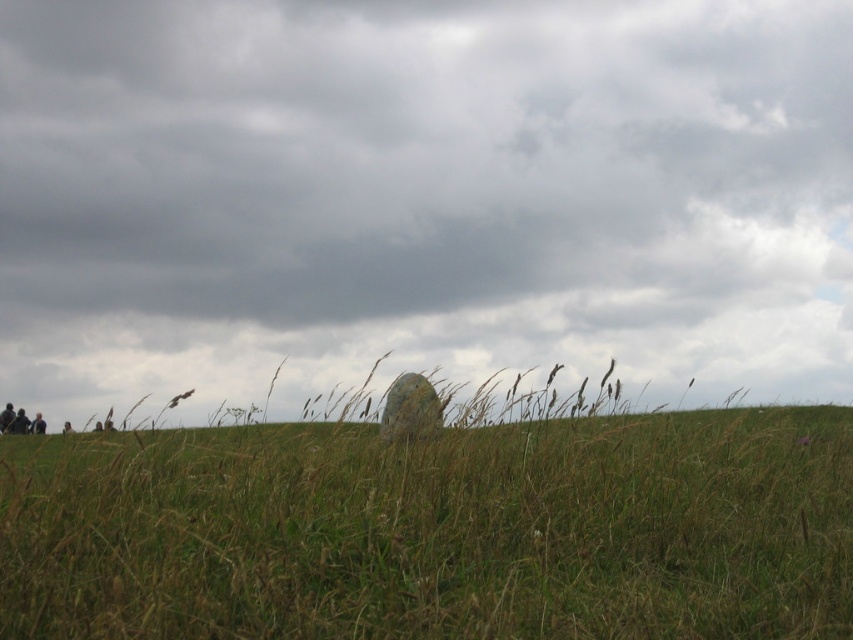
Question: Considering the relative positions of gray cloudy sky at upper center and green grass at center in the image provided, where is gray cloudy sky at upper center located with respect to green grass at center?

Choices:
 (A) below
 (B) above

Answer: (B)

Question: Which object is closer to the camera taking this photo?

Choices:
 (A) gray cloudy sky at upper center
 (B) green grass at center

Answer: (B)

Question: Which object appears closest to the camera in this image?

Choices:
 (A) gray cloudy sky at upper center
 (B) green grass at center

Answer: (B)

Question: Considering the relative positions of gray cloudy sky at upper center and green grass at center in the image provided, where is gray cloudy sky at upper center located with respect to green grass at center?

Choices:
 (A) below
 (B) above

Answer: (B)

Question: Among these points, which one is farthest from the camera?

Choices:
 (A) (131, 93)
 (B) (666, 422)

Answer: (A)

Question: Does gray cloudy sky at upper center lie behind green grass at center?

Choices:
 (A) yes
 (B) no

Answer: (A)